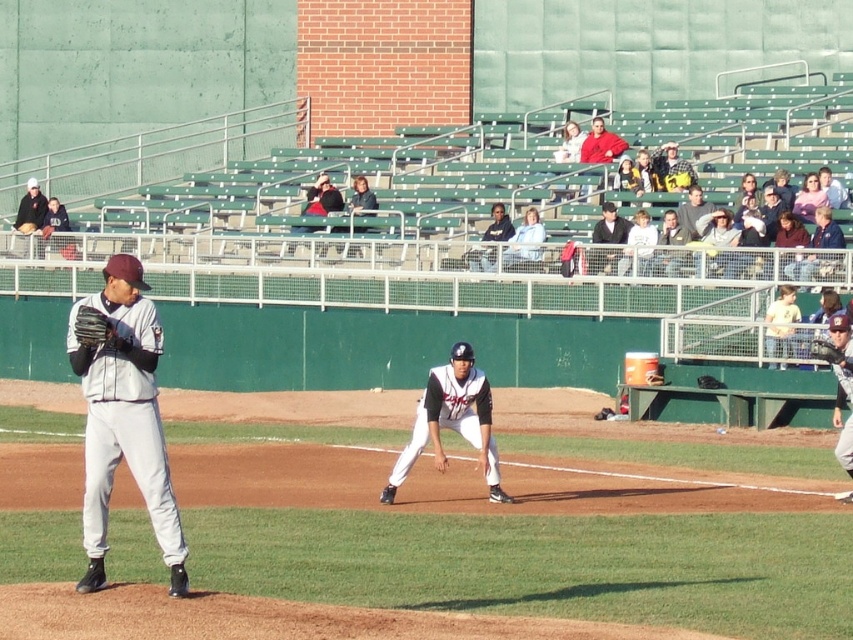
You are a photographer standing at the edge of the field. You want to take a photo that includes both the pitcher and the fielder. Which player will appear larger in your photo if you focus on the closer point between point (791, 276) and point (828, 193)?

Point (791, 276) is closer to the camera than point (828, 193). Since the pitcher is at point (791, 276), they will appear larger in the photo than the fielder at point (828, 193).

You are a photographer standing at the center of the baseball field. You want to take a photo of the two points mentioned in the scene. Which point, point (637, 260) or point (490, 264), will appear larger in your photo?

Point (637, 260) will appear larger in the photo because it is closer to the viewer than point (490, 264).